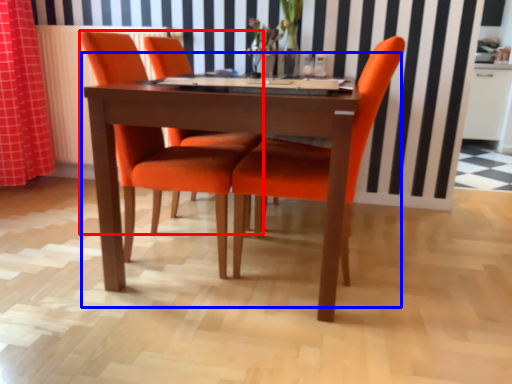
Question: Which object is further to the camera taking this photo, chair (highlighted by a red box) or kitchen & dining room table (highlighted by a blue box)?

Choices:
 (A) chair
 (B) kitchen & dining room table

Answer: (A)